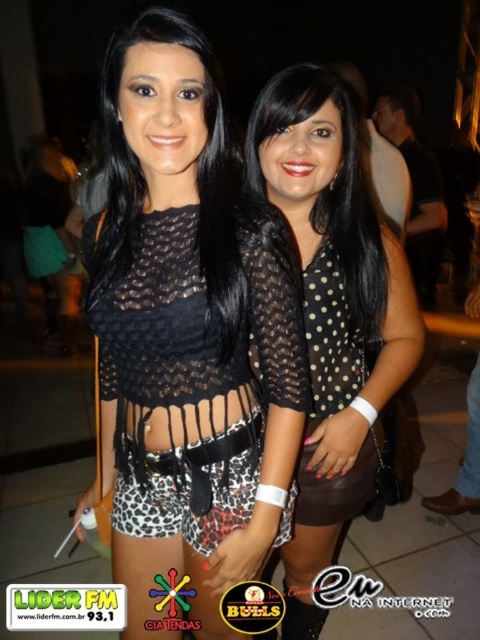
Consider the image. Can you confirm if leopard print shorts at center is shorter than black dotted shirt at center?

Yes, leopard print shorts at center is shorter than black dotted shirt at center.

Which is above, leopard print shorts at center or black dotted shirt at center?

leopard print shorts at center is above.

Is point (148, 400) closer to viewer compared to point (344, 349)?

Yes, it is.

The width and height of the screenshot is (480, 640). I want to click on leopard print shorts at center, so click(x=189, y=337).

Which is below, black dotted shirt at center or black lace top at center?

black dotted shirt at center

Is point (328, 355) positioned in front of point (172, 22)?

No, it is not.

This screenshot has width=480, height=640. What are the coordinates of `black dotted shirt at center` in the screenshot? It's located at click(333, 310).

Where is `black dotted shirt at center`? black dotted shirt at center is located at coordinates pos(333,310).

Can you confirm if black lace top at center is positioned below black dotted sheer blouse at center?

Actually, black lace top at center is above black dotted sheer blouse at center.

Can you confirm if black lace top at center is positioned above black dotted sheer blouse at center?

Yes.

Locate an element on the screen. black lace top at center is located at coordinates (194, 179).